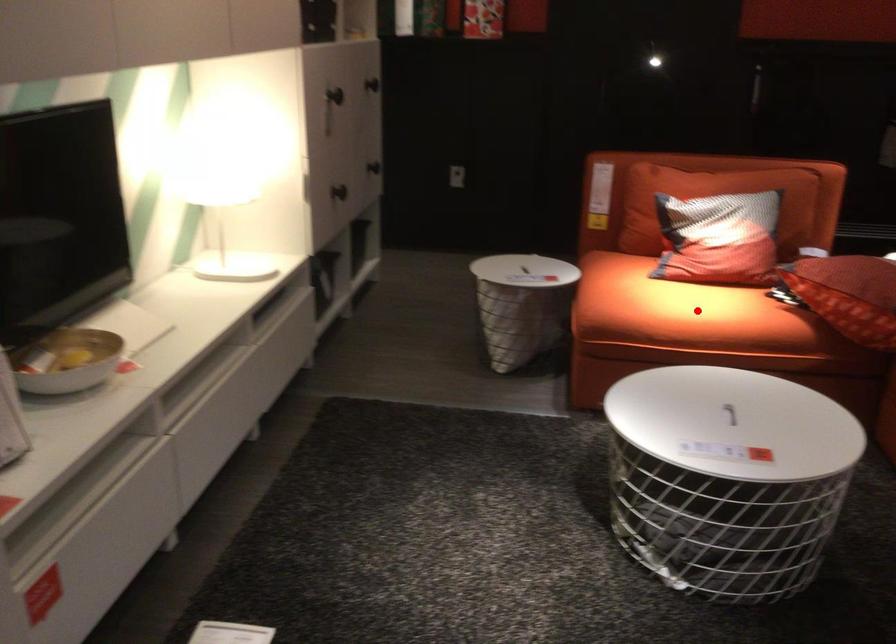
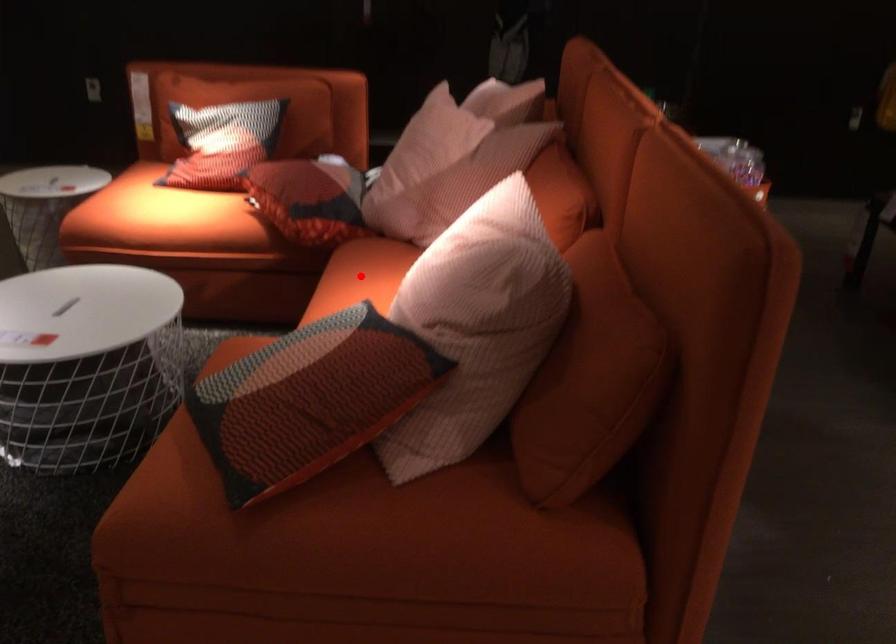
I am providing you with two images of the same scene from different viewpoints. A red point is marked on the first image and another point is marked on the second image. Does the point marked in image1 correspond to the same location as the one in image2?

No